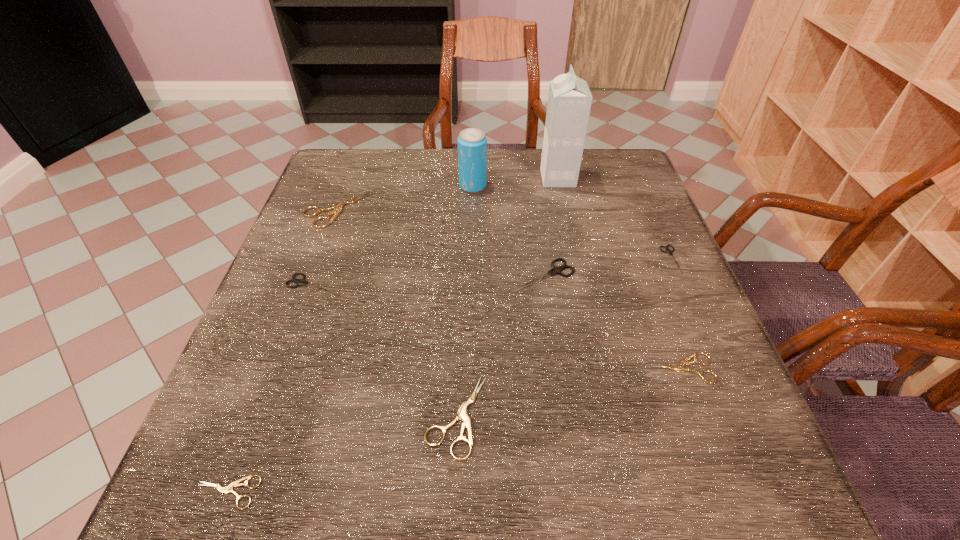
Find the location of a particular element. The width and height of the screenshot is (960, 540). the tallest object is located at coordinates (569, 103).

At what (x,y) coordinates should I click in order to perform the action: click on soda can. Please return your answer as a coordinate pair (x, y). The height and width of the screenshot is (540, 960). Looking at the image, I should click on (472, 143).

The height and width of the screenshot is (540, 960). I want to click on the second black shears from left to right, so click(555, 270).

The image size is (960, 540). I want to click on the biggest black shears, so click(x=555, y=270).

In order to click on the biggest beige shears in this screenshot , I will do `click(338, 207)`.

The width and height of the screenshot is (960, 540). What are the coordinates of `the farthest beige shears` in the screenshot? It's located at [x=338, y=207].

Locate an element on the screen. Image resolution: width=960 pixels, height=540 pixels. the leftmost black shears is located at coordinates (300, 282).

This screenshot has height=540, width=960. Find the location of `the fourth shears from left to right`. the fourth shears from left to right is located at coordinates (461, 414).

You are a GUI agent. You are given a task and a screenshot of the screen. Output one action in this format:
    pyautogui.click(x=<x>, y=<y>)
    Task: Click on the second biggest beige shears
    
    Given the screenshot: What is the action you would take?
    pyautogui.click(x=461, y=414)

Locate an element on the screen. the rightmost beige shears is located at coordinates (681, 367).